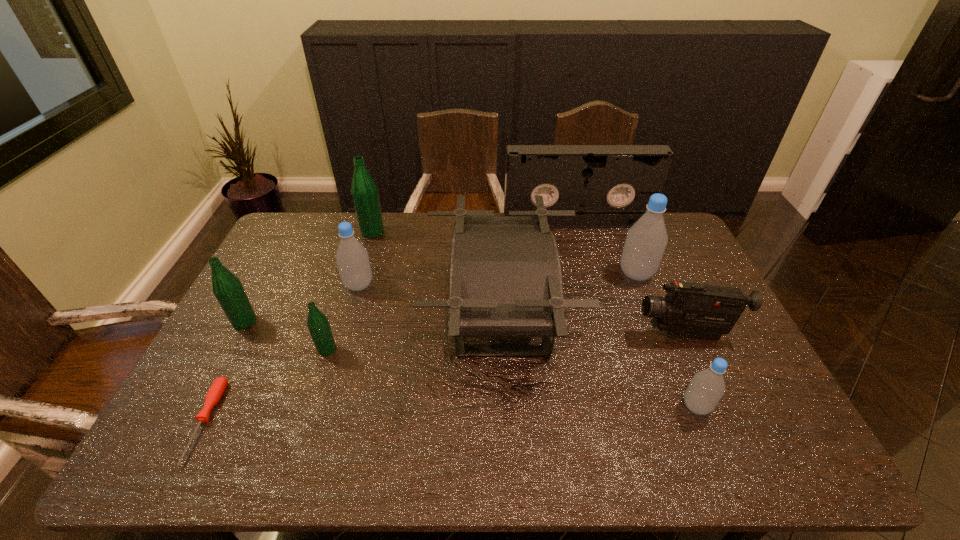
The width and height of the screenshot is (960, 540). In order to click on vacant space that satisfies the following two spatial constraints: 1. on the side of the biggest gray bottle with visible spindles; 2. on the left side of the videotape in this screenshot , I will do `click(590, 274)`.